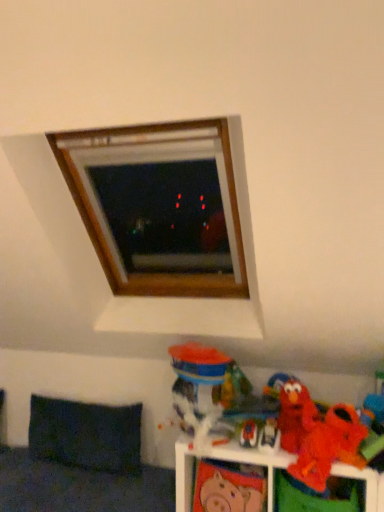
Question: From a real-world perspective, is matte pink piggy bank at lower center, the sixth toy in the right-to-left sequence, above or below orange plush toy at lower right, marked as the 1th toy in a right-to-left arrangement?

Choices:
 (A) above
 (B) below

Answer: (B)

Question: From the image's perspective, is matte pink piggy bank at lower center, acting as the second toy starting from the left, located above or below orange plush toy at lower right, placed as the 7th toy when sorted from left to right?

Choices:
 (A) above
 (B) below

Answer: (B)

Question: Estimate the real-world distances between objects in this image. Which object is farther from the translucent plastic cup at lower center, positioned as the seventh toy in right-to-left order?

Choices:
 (A) orange plush toy at lower right, marked as the 1th toy in a right-to-left arrangement
 (B) red plush toy at lower right, arranged as the 5th toy when viewed from the left
 (C) matte red plush at lower right, which is counted as the 6th toy, starting from the left
 (D) matte plastic toy at lower right, the 5th toy from the right
 (E) matte pink piggy bank at lower center, the sixth toy in the right-to-left sequence

Answer: (A)

Question: Which object is positioned farthest from the translucent plastic cup at lower center, which ranks as the 1th toy in left-to-right order?

Choices:
 (A) red plush toy at lower right, the 3th toy from the right
 (B) orange plush toy at lower right, placed as the 7th toy when sorted from left to right
 (C) dark fabric pillow at lower left
 (D) matte plastic elmo at lower right, the fourth toy positioned from the left
 (E) matte red plush at lower right, which is the 2th toy in right-to-left order

Answer: (B)